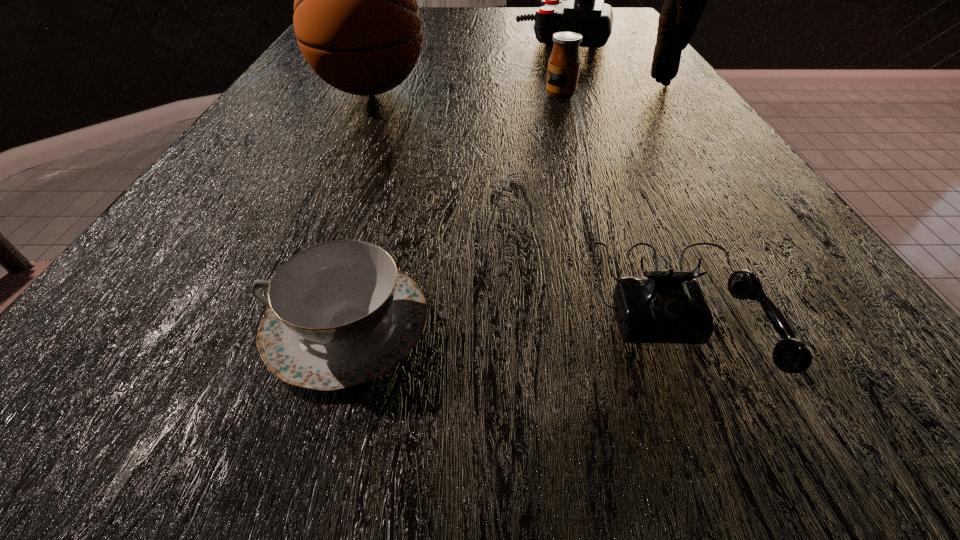
Find the location of a particular element. This screenshot has width=960, height=540. joystick at the right edge is located at coordinates (584, 12).

The image size is (960, 540). Find the location of `telephone at the right edge`. telephone at the right edge is located at coordinates (669, 306).

Where is `object located at the far right corner`? Image resolution: width=960 pixels, height=540 pixels. object located at the far right corner is located at coordinates (584, 12).

In the image, there is a desktop. What are the coordinates of `free space at the far edge` in the screenshot? It's located at (450, 26).

The image size is (960, 540). Find the location of `vacant space at the near edge of the desktop`. vacant space at the near edge of the desktop is located at coordinates (287, 524).

Where is `free space at the left edge of the desktop`? This screenshot has width=960, height=540. free space at the left edge of the desktop is located at coordinates (287, 82).

Image resolution: width=960 pixels, height=540 pixels. In the image, there is a desktop. Identify the location of vacant region at the right edge. (649, 73).

The width and height of the screenshot is (960, 540). What are the coordinates of `free point between the joystick and the chinaware` in the screenshot? It's located at (456, 182).

Find the location of a particular element. The image size is (960, 540). free space between the chinaware and the tallest object is located at coordinates (505, 204).

The width and height of the screenshot is (960, 540). What are the coordinates of `blank region between the chinaware and the honey` in the screenshot? It's located at (454, 211).